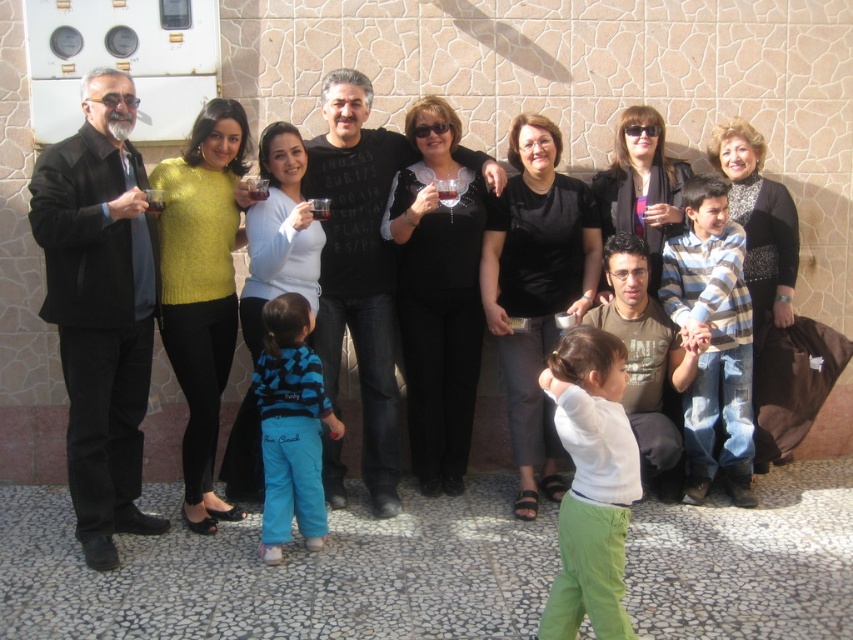
Measure the distance between matte black shirt at center and camera.

matte black shirt at center is 4.40 meters from camera.

Who is more forward, (107, 525) or (111, 524)?

Point (107, 525) is in front.

The image size is (853, 640). I want to click on matte black shirt at center, so click(138, 300).

Between point (373, 344) and point (407, 285), which one is positioned in front?

Point (373, 344) is in front.

Who is positioned more to the right, black matte shirt at center or black matte pants at center?

From the viewer's perspective, black matte pants at center appears more on the right side.

Who is more distant from viewer, (360, 298) or (461, 273)?

Positioned behind is point (461, 273).

What are the coordinates of `black matte shirt at center` in the screenshot? It's located at (358, 268).

Can you confirm if black knitwear at upper right is positioned above black leather jacket at upper center?

Incorrect, black knitwear at upper right is not positioned above black leather jacket at upper center.

Is black knitwear at upper right to the left of black leather jacket at upper center from the viewer's perspective?

No, black knitwear at upper right is not to the left of black leather jacket at upper center.

Describe the element at coordinates (759, 221) in the screenshot. I see `black knitwear at upper right` at that location.

The height and width of the screenshot is (640, 853). Identify the location of black knitwear at upper right. (759, 221).